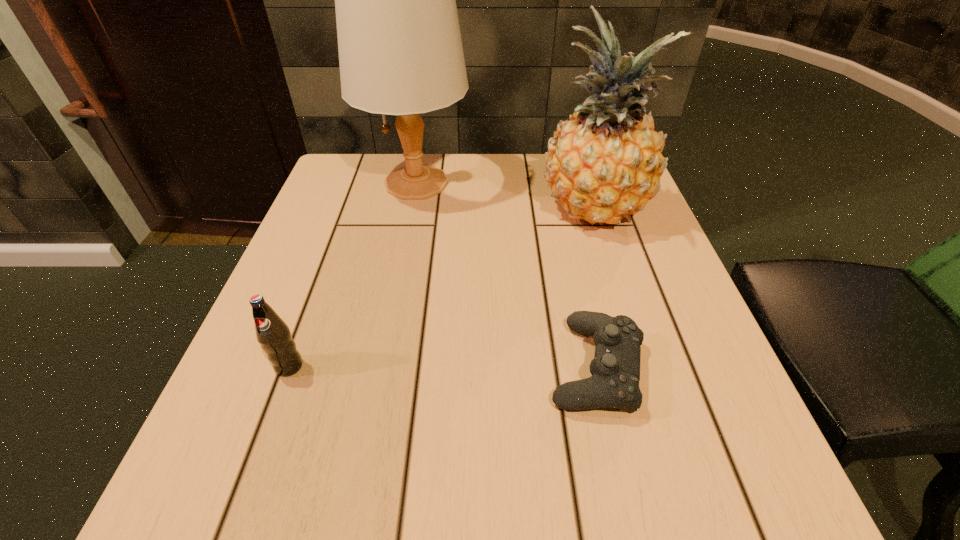
This screenshot has width=960, height=540. Find the location of `vacant space at the far left corner`. vacant space at the far left corner is located at coordinates (362, 207).

In the image, there is a desktop. Where is `free space at the near left corner`? The image size is (960, 540). free space at the near left corner is located at coordinates (263, 477).

Image resolution: width=960 pixels, height=540 pixels. Find the location of `free area in between the pop and the shortest object`. free area in between the pop and the shortest object is located at coordinates (443, 366).

At what (x,y) coordinates should I click in order to perform the action: click on free space that is in between the pineapple and the third tallest object. Please return your answer as a coordinate pair (x, y). This screenshot has width=960, height=540. Looking at the image, I should click on (442, 288).

Identify the location of free space between the table lamp and the shortest object. This screenshot has height=540, width=960. (506, 274).

Find the location of a particular element. The width and height of the screenshot is (960, 540). free point between the second shortest object and the table lamp is located at coordinates point(352,274).

Identify the location of vacant point located between the pineapple and the table lamp. (505, 197).

This screenshot has height=540, width=960. In order to click on vacant space that is in between the shortest object and the table lamp in this screenshot , I will do `click(506, 274)`.

You are a GUI agent. You are given a task and a screenshot of the screen. Output one action in this format:
    pyautogui.click(x=<x>, y=<y>)
    Task: Click on the free space that is in between the table lamp and the control
    Image resolution: width=960 pixels, height=540 pixels.
    Given the screenshot: What is the action you would take?
    pyautogui.click(x=506, y=274)

The width and height of the screenshot is (960, 540). I want to click on vacant region between the second shortest object and the pineapple, so click(x=442, y=288).